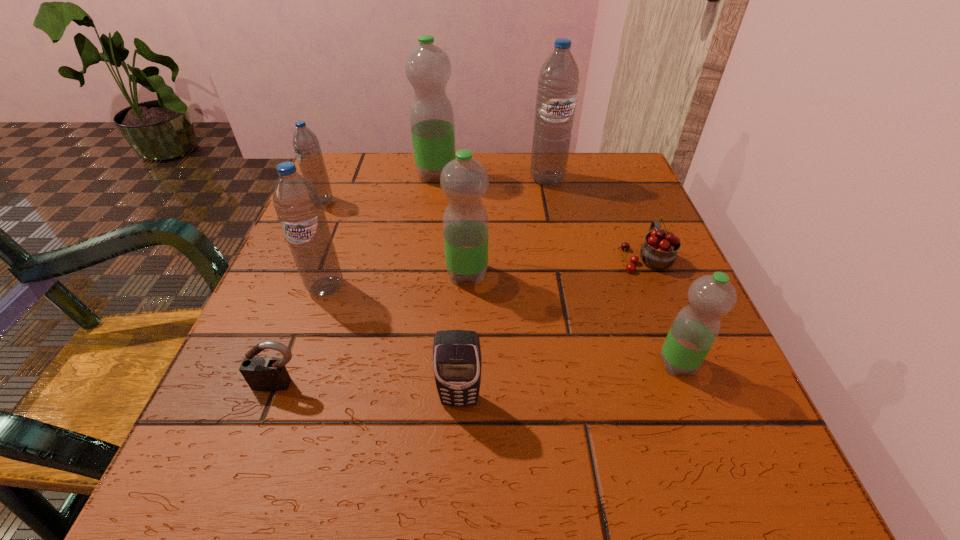
This screenshot has width=960, height=540. In order to click on free space located 0.090m on the handle side of the cherry in this screenshot , I will do `click(628, 214)`.

Locate an element on the screen. The image size is (960, 540). free space located 0.180m on the handle side of the cherry is located at coordinates tap(618, 191).

This screenshot has height=540, width=960. What are the coordinates of `free point located on the handle side of the cherry` in the screenshot? It's located at (611, 172).

Where is `padlock that is at the left edge`? padlock that is at the left edge is located at coordinates (261, 373).

Where is `water bottle that is at the right edge`? water bottle that is at the right edge is located at coordinates (695, 328).

Identify the location of cherry that is at the right edge. (659, 251).

Locate an element on the screen. object present at the far left corner is located at coordinates (306, 145).

This screenshot has height=540, width=960. What are the coordinates of `free spot at the far edge of the desktop` in the screenshot? It's located at (560, 207).

The height and width of the screenshot is (540, 960). In the image, there is a desktop. In order to click on vacant space at the near edge in this screenshot , I will do `click(631, 466)`.

You are a GUI agent. You are given a task and a screenshot of the screen. Output one action in this format:
    pyautogui.click(x=<x>, y=<y>)
    Task: Click on the vacant space at the left edge
    
    Given the screenshot: What is the action you would take?
    pyautogui.click(x=322, y=381)